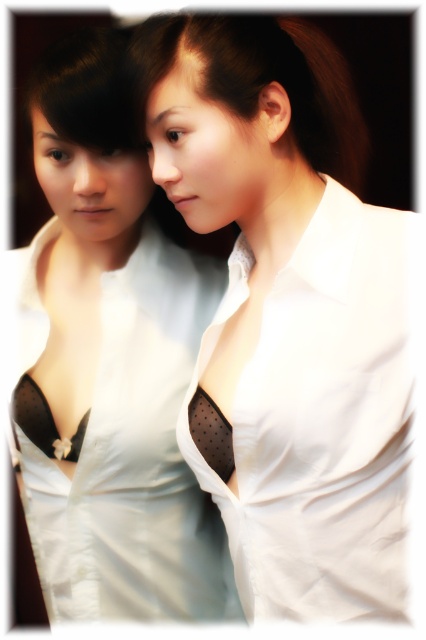
Question: Is white matte shirt at center closer to the viewer compared to matte white blouse at center?

Choices:
 (A) no
 (B) yes

Answer: (A)

Question: Which of the following is the farthest from the observer?

Choices:
 (A) (127, 593)
 (B) (347, 72)
 (C) (348, 284)

Answer: (B)

Question: Does white matte shirt at center appear on the right side of matte white blouse at center?

Choices:
 (A) yes
 (B) no

Answer: (A)

Question: Is white matte shirt at center to the right of white satin blouse at center from the viewer's perspective?

Choices:
 (A) no
 (B) yes

Answer: (B)

Question: Which object is closer to the camera taking this photo?

Choices:
 (A) matte white blouse at center
 (B) white matte shirt at center

Answer: (A)

Question: Among these objects, which one is farthest from the camera?

Choices:
 (A) white matte shirt at center
 (B) white satin blouse at center

Answer: (B)